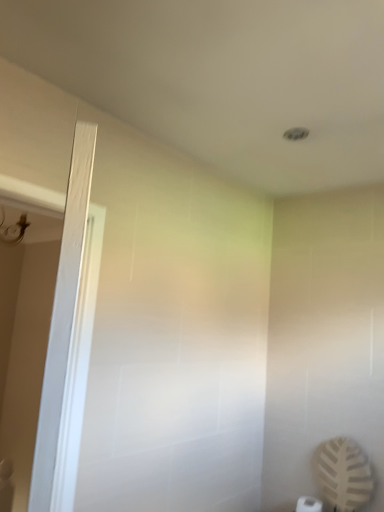
Question: Should I look upward or downward to see white wood screen door at left?

Choices:
 (A) up
 (B) down

Answer: (B)

Question: Is white matte toilet paper at lower right oriented away from white wood screen door at left?

Choices:
 (A) no
 (B) yes

Answer: (A)

Question: Is white matte toilet paper at lower right next to white wood screen door at left?

Choices:
 (A) no
 (B) yes

Answer: (A)

Question: Is white matte toilet paper at lower right positioned far away from white wood screen door at left?

Choices:
 (A) yes
 (B) no

Answer: (A)

Question: Can you confirm if white matte toilet paper at lower right is positioned to the left of white wood screen door at left?

Choices:
 (A) yes
 (B) no

Answer: (B)

Question: From a real-world perspective, is white matte toilet paper at lower right below white wood screen door at left?

Choices:
 (A) yes
 (B) no

Answer: (A)

Question: Is white matte toilet paper at lower right positioned before white wood screen door at left?

Choices:
 (A) yes
 (B) no

Answer: (B)

Question: Is white wood screen door at left positioned beyond the bounds of white matte toilet paper at lower right?

Choices:
 (A) yes
 (B) no

Answer: (A)

Question: From a real-world perspective, is white wood screen door at left physically below white matte toilet paper at lower right?

Choices:
 (A) yes
 (B) no

Answer: (B)

Question: Is white wood screen door at left positioned far away from white matte toilet paper at lower right?

Choices:
 (A) yes
 (B) no

Answer: (A)

Question: Considering the relative positions of white wood screen door at left and white matte toilet paper at lower right in the image provided, is white wood screen door at left to the left of white matte toilet paper at lower right from the viewer's perspective?

Choices:
 (A) yes
 (B) no

Answer: (A)

Question: Is white wood screen door at left thinner than white matte toilet paper at lower right?

Choices:
 (A) no
 (B) yes

Answer: (B)

Question: Considering the relative sizes of white wood screen door at left and white matte toilet paper at lower right in the image provided, is white wood screen door at left wider than white matte toilet paper at lower right?

Choices:
 (A) yes
 (B) no

Answer: (B)

Question: From a real-world perspective, is white wood screen door at left above or below white matte toilet paper at lower right?

Choices:
 (A) below
 (B) above

Answer: (B)